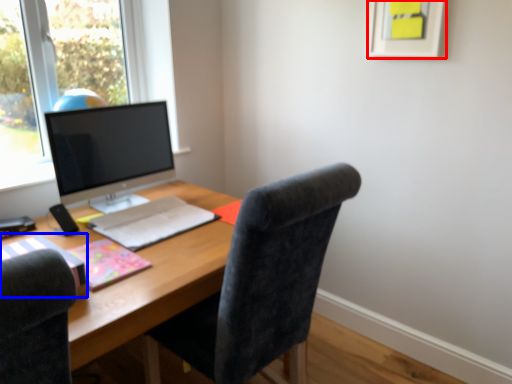
Question: Among these objects, which one is nearest to the camera, picture frame (highlighted by a red box) or notebook (highlighted by a blue box)?

Choices:
 (A) picture frame
 (B) notebook

Answer: (B)